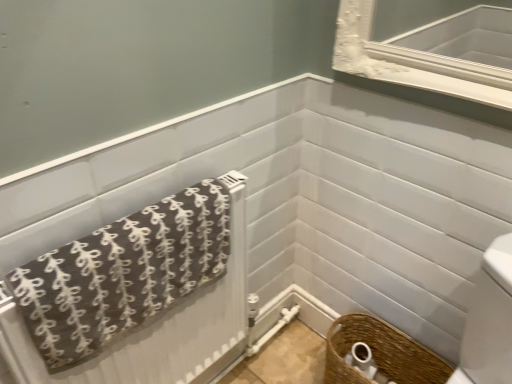
What do you see at coordinates (122, 274) in the screenshot? The height and width of the screenshot is (384, 512). I see `brown fabric towel at lower left` at bounding box center [122, 274].

The height and width of the screenshot is (384, 512). Identify the location of woven brown basket at lower right. (365, 363).

Locate an element on the screen. Image resolution: width=512 pixels, height=384 pixels. woven brown basket at lower right is located at coordinates click(380, 353).

Does woven brown basket at lower right have a greater width compared to brown fabric towel at lower left?

Yes.

Can you see woven brown basket at lower right touching brown fabric towel at lower left?

No, woven brown basket at lower right is not touching brown fabric towel at lower left.

In order to click on basket below the brown fabric towel at lower left (from the image's perspective) in this screenshot , I will do `click(380, 353)`.

Can you confirm if woven brown basket at lower right is taller than brown fabric towel at lower left?

Correct, woven brown basket at lower right is much taller as brown fabric towel at lower left.

From the image's perspective, does brown fabric towel at lower left appear lower than woven brown basket at lower right?

Actually, brown fabric towel at lower left appears above woven brown basket at lower right in the image.

Is brown fabric towel at lower left closer to the viewer compared to woven brown basket at lower right?

Yes, brown fabric towel at lower left is in front of woven brown basket at lower right.

Considering the sizes of woven brown basket at lower right and woven brown basket at lower right in the image, is woven brown basket at lower right bigger or smaller than woven brown basket at lower right?

woven brown basket at lower right is smaller than woven brown basket at lower right.

In the image, is woven brown basket at lower right positioned in front of or behind woven brown basket at lower right?

woven brown basket at lower right is behind woven brown basket at lower right.

Who is taller, woven brown basket at lower right or woven brown basket at lower right?

Standing taller between the two is woven brown basket at lower right.

Locate an element on the screen. towel above the woven brown basket at lower right (from the image's perspective) is located at coordinates (122, 274).

Is brown fabric towel at lower left oriented away from woven brown basket at lower right?

brown fabric towel at lower left is not turned away from woven brown basket at lower right.

From a real-world perspective, is brown fabric towel at lower left beneath woven brown basket at lower right?

No, from a real-world perspective, brown fabric towel at lower left is not beneath woven brown basket at lower right.

Does point (82, 266) lie behind point (366, 353)?

No, it is not.

Considering their positions, is woven brown basket at lower right located in front of or behind woven brown basket at lower right?

Clearly, woven brown basket at lower right is in front of woven brown basket at lower right.

From the image's perspective, is woven brown basket at lower right positioned above or below woven brown basket at lower right?

Based on their image positions, woven brown basket at lower right is located beneath woven brown basket at lower right.

Can you confirm if woven brown basket at lower right is positioned to the left of woven brown basket at lower right?

In fact, woven brown basket at lower right is to the right of woven brown basket at lower right.

Identify the location of toilet paper located underneath the brown fabric towel at lower left (from a real-world perspective). (365, 363).

Looking at this image, is woven brown basket at lower right closer to camera compared to brown fabric towel at lower left?

No, woven brown basket at lower right is further to the viewer.

Which object is wider, woven brown basket at lower right or brown fabric towel at lower left?

brown fabric towel at lower left is wider.

Is the surface of woven brown basket at lower right in direct contact with brown fabric towel at lower left?

No.

The height and width of the screenshot is (384, 512). Identify the location of basket located underneath the brown fabric towel at lower left (from a real-world perspective). [x=380, y=353].

The image size is (512, 384). I want to click on towel above the woven brown basket at lower right (from a real-world perspective), so click(x=122, y=274).

Considering their positions, is woven brown basket at lower right positioned closer to brown fabric towel at lower left than woven brown basket at lower right?

Among the two, woven brown basket at lower right is located nearer to brown fabric towel at lower left.

Considering their positions, is woven brown basket at lower right positioned closer to woven brown basket at lower right than brown fabric towel at lower left?

The object closer to woven brown basket at lower right is woven brown basket at lower right.

Considering their positions, is brown fabric towel at lower left positioned closer to woven brown basket at lower right than woven brown basket at lower right?

The object closer to woven brown basket at lower right is woven brown basket at lower right.

Looking at the image, which one is located closer to woven brown basket at lower right, woven brown basket at lower right or brown fabric towel at lower left?

The object closer to woven brown basket at lower right is woven brown basket at lower right.

Based on their spatial positions, is brown fabric towel at lower left or woven brown basket at lower right further from woven brown basket at lower right?

brown fabric towel at lower left is positioned further to the anchor woven brown basket at lower right.

Looking at this image, from the image, which object appears to be farther from brown fabric towel at lower left, woven brown basket at lower right or woven brown basket at lower right?

woven brown basket at lower right.

Where is `toilet paper between brown fabric towel at lower left and woven brown basket at lower right`? toilet paper between brown fabric towel at lower left and woven brown basket at lower right is located at coordinates tap(365, 363).